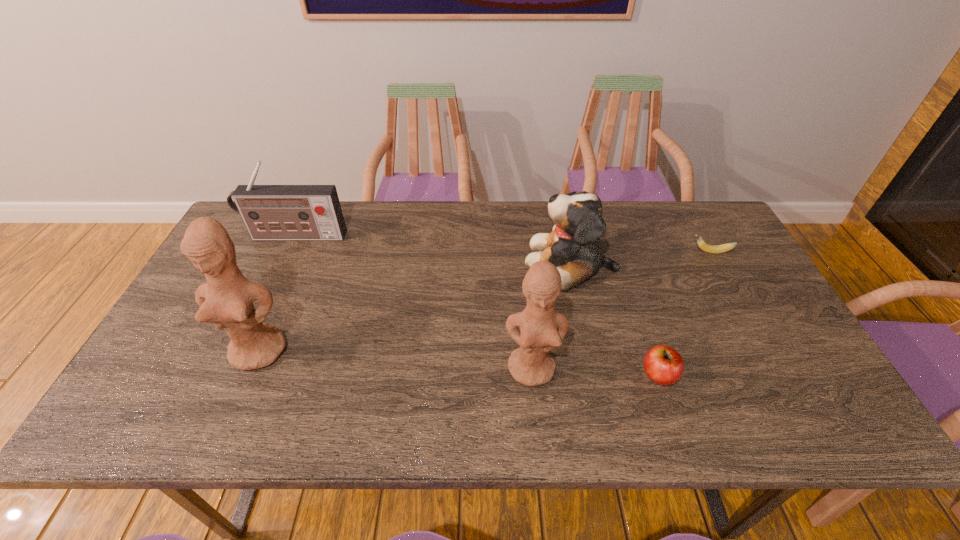
Locate an element on the screen. figurine located in the left edge section of the desktop is located at coordinates (226, 300).

Where is `radio receiver that is at the left edge`? radio receiver that is at the left edge is located at coordinates pyautogui.click(x=270, y=212).

Where is `object situated at the right edge`? object situated at the right edge is located at coordinates (715, 249).

I want to click on object located at the far left corner, so click(270, 212).

Where is `object present at the near left corner`? object present at the near left corner is located at coordinates (226, 300).

This screenshot has height=540, width=960. In the image, there is a desktop. What are the coordinates of `blank space at the far edge` in the screenshot? It's located at (x=660, y=230).

You are a GUI agent. You are given a task and a screenshot of the screen. Output one action in this format:
    pyautogui.click(x=<x>, y=<y>)
    Task: Click on the free location at the near edge
    The width and height of the screenshot is (960, 540).
    Given the screenshot: What is the action you would take?
    pyautogui.click(x=278, y=370)

Locate an element on the screen. The width and height of the screenshot is (960, 540). vacant space at the right edge of the desktop is located at coordinates (736, 307).

I want to click on vacant space that is in between the taller figurine and the right figurine, so click(x=396, y=359).

What are the coordinates of `free area in between the rightmost object and the second shortest object` in the screenshot? It's located at (684, 313).